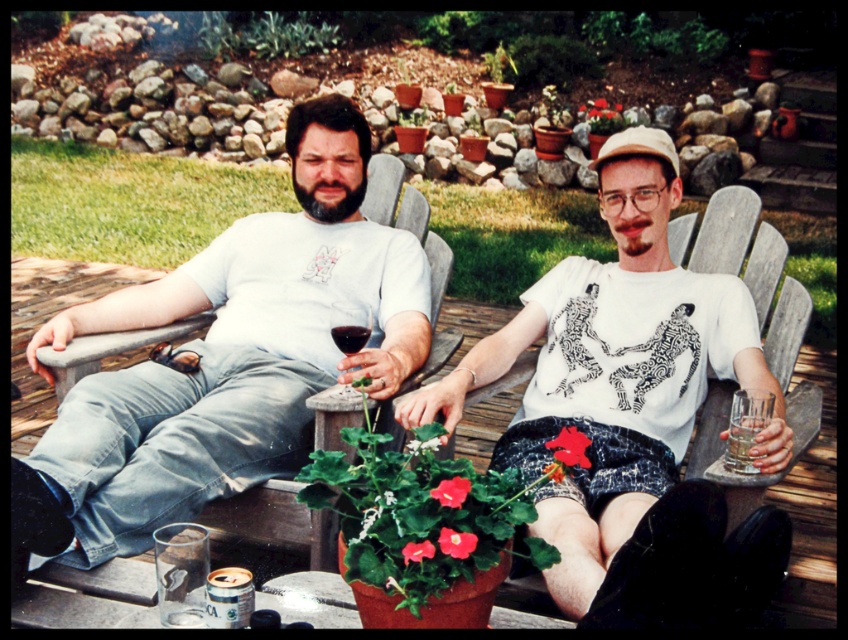
Is point (332, 326) positioned behind point (349, 339)?

Yes, point (332, 326) is behind point (349, 339).

Can you confirm if matte glass wine at center is taller than dark red glass at center?

Yes.

Image resolution: width=848 pixels, height=640 pixels. In order to click on matte glass wine at center in this screenshot , I will do click(x=350, y=326).

Where is `matte glass wine at center`? Image resolution: width=848 pixels, height=640 pixels. matte glass wine at center is located at coordinates (350, 326).

This screenshot has height=640, width=848. Describe the element at coordinates (350, 326) in the screenshot. I see `matte glass wine at center` at that location.

In the scene shown: Can you confirm if matte glass wine at center is positioned to the left of clear glass water at right?

Indeed, matte glass wine at center is positioned on the left side of clear glass water at right.

Is point (360, 342) behind point (759, 468)?

Yes, point (360, 342) is farther from viewer.

You are a GUI agent. You are given a task and a screenshot of the screen. Output one action in this format:
    pyautogui.click(x=<x>, y=<y>)
    Task: Click on the matte glass wine at center
    
    Given the screenshot: What is the action you would take?
    pyautogui.click(x=350, y=326)

Is matte white t-shirt at left below matte glass wine at center?

No.

Which of these two, matte white t-shirt at left or matte glass wine at center, stands taller?

Standing taller between the two is matte white t-shirt at left.

I want to click on matte white t-shirt at left, so click(224, 360).